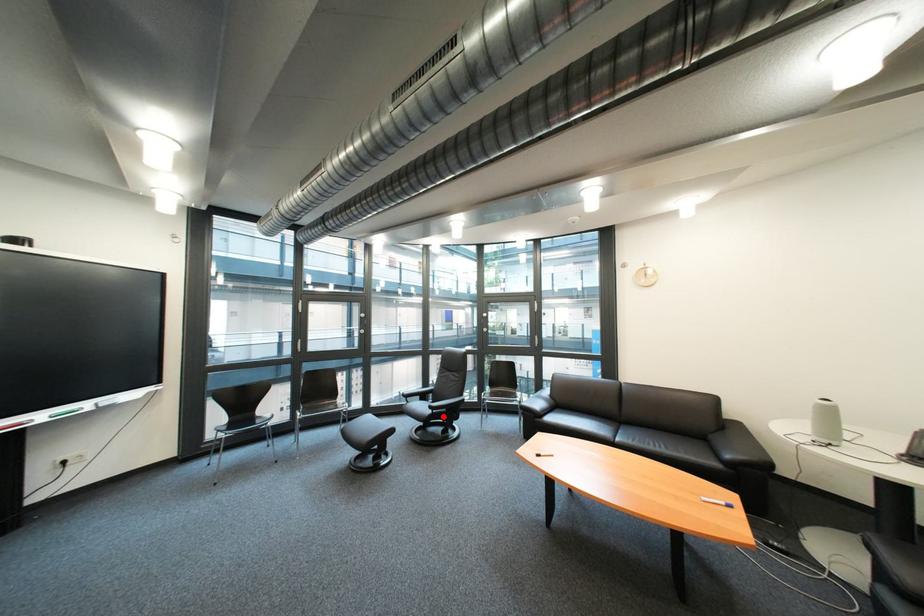
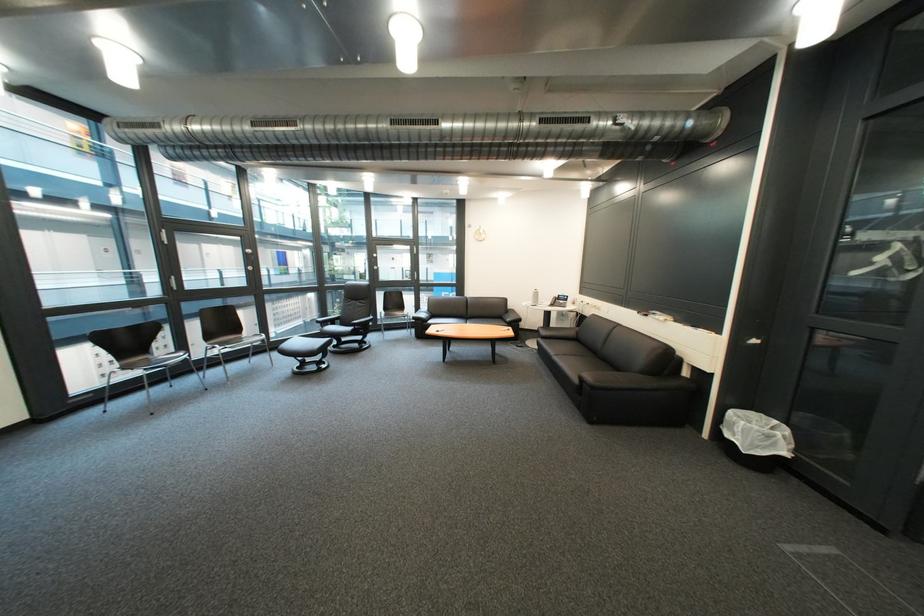
Locate, in the second image, the point that corresponds to the highlighted location in the first image.

(366, 331)